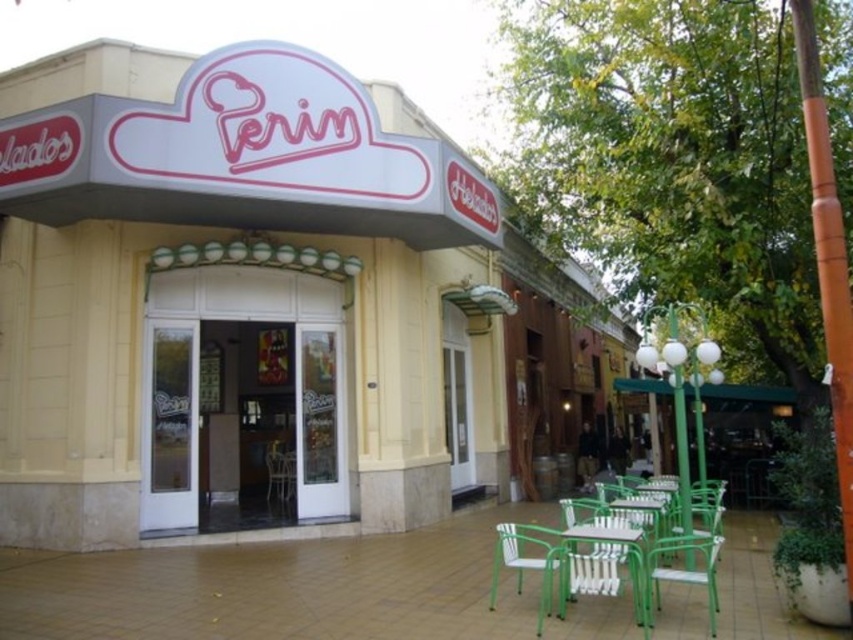
You are a customer entering the Perim ice cream shop and want to sit down. You see a green metal chair at lower right and a green plastic chair at lower center. Which chair is closer to the entrance?

The green plastic chair at lower center is closer to the entrance because the green metal chair at lower right is positioned over it, indicating it is further away.